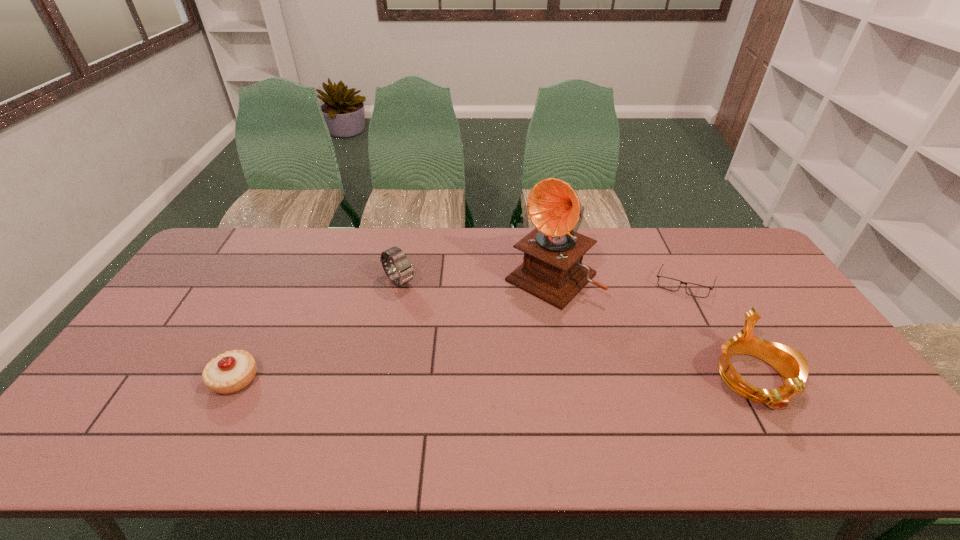
At what (x,y) coordinates should I click in order to perform the action: click on pastry that is at the near edge. Please return your answer as a coordinate pair (x, y). The height and width of the screenshot is (540, 960). Looking at the image, I should click on (230, 372).

Where is `tiara located in the near edge section of the desktop`? This screenshot has height=540, width=960. tiara located in the near edge section of the desktop is located at coordinates (793, 367).

Where is `object at the right edge`? The image size is (960, 540). object at the right edge is located at coordinates (793, 367).

Find the location of a particular element. object at the near right corner is located at coordinates (793, 367).

Locate an element on the screen. free space at the far edge of the desktop is located at coordinates (371, 246).

Locate an element on the screen. The height and width of the screenshot is (540, 960). vacant space at the near edge of the desktop is located at coordinates (307, 420).

At what (x,y) coordinates should I click in order to perform the action: click on vacant space at the right edge of the desktop. Please return your answer as a coordinate pair (x, y). This screenshot has width=960, height=540. Looking at the image, I should click on [775, 280].

In the image, there is a desktop. Where is `free region at the far left corner`? The height and width of the screenshot is (540, 960). free region at the far left corner is located at coordinates (214, 265).

This screenshot has height=540, width=960. In the image, there is a desktop. Identify the location of vacant space at the near left corner. (161, 395).

Image resolution: width=960 pixels, height=540 pixels. I want to click on free point at the far right corner, so click(x=733, y=229).